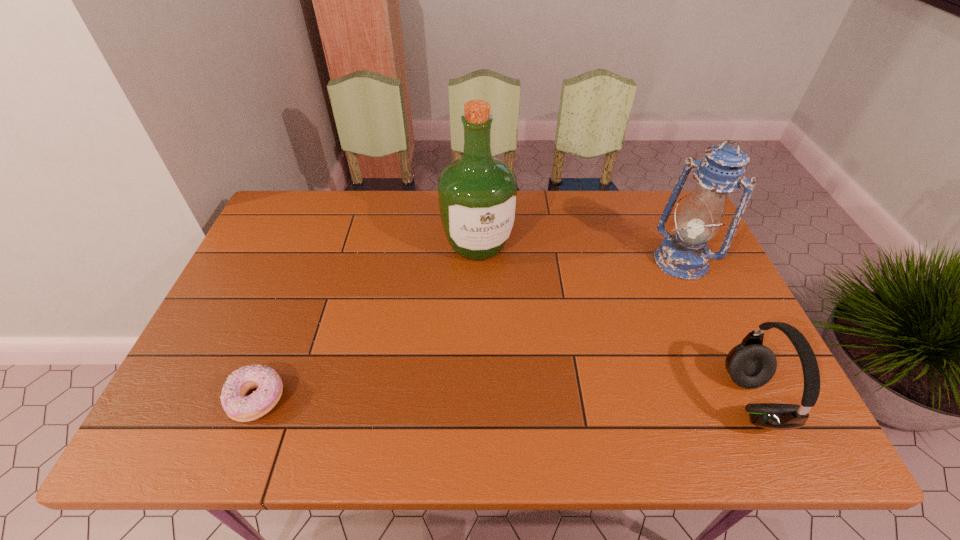
Where is `lantern present at the right edge`? lantern present at the right edge is located at coordinates (685, 255).

This screenshot has width=960, height=540. What are the coordinates of `object positioned at the near left corner` in the screenshot? It's located at (239, 407).

I want to click on object that is at the near right corner, so pos(750,364).

Where is `free space at the far edge`? free space at the far edge is located at coordinates (519, 211).

Locate an element on the screen. This screenshot has height=540, width=960. vacant region at the near edge of the desktop is located at coordinates (365, 375).

Identify the location of vacant space at the left edge of the desktop. (228, 321).

Locate an element on the screen. The height and width of the screenshot is (540, 960). vacant space at the right edge of the desktop is located at coordinates (692, 289).

The image size is (960, 540). I want to click on vacant space at the far left corner, so click(303, 224).

The height and width of the screenshot is (540, 960). I want to click on vacant space at the far right corner of the desktop, so click(652, 194).

Locate an element on the screen. Image resolution: width=960 pixels, height=540 pixels. vacant area between the lantern and the doughnut is located at coordinates (469, 330).